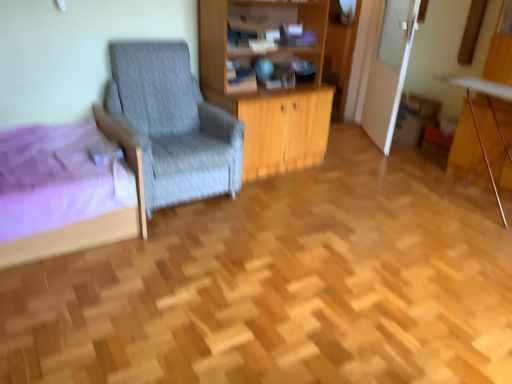
Question: Can you confirm if purple fabric bed at lower left is thinner than wooden cabinet at center?

Choices:
 (A) no
 (B) yes

Answer: (A)

Question: Is wooden cabinet at center completely or partially inside purple fabric bed at lower left?

Choices:
 (A) no
 (B) yes

Answer: (A)

Question: Is purple fabric bed at lower left bigger than wooden cabinet at center?

Choices:
 (A) no
 (B) yes

Answer: (A)

Question: Does purple fabric bed at lower left lie behind wooden cabinet at center?

Choices:
 (A) yes
 (B) no

Answer: (B)

Question: Is wooden cabinet at center at the back of purple fabric bed at lower left?

Choices:
 (A) yes
 (B) no

Answer: (B)

Question: Does purple fabric bed at lower left have a smaller size compared to wooden cabinet at center?

Choices:
 (A) yes
 (B) no

Answer: (A)

Question: Can you confirm if wooden cabinet at center is positioned to the right of gray fabric chair at left?

Choices:
 (A) no
 (B) yes

Answer: (B)

Question: Is gray fabric chair at left located within wooden cabinet at center?

Choices:
 (A) yes
 (B) no

Answer: (B)

Question: Could you tell me if wooden cabinet at center is facing gray fabric chair at left?

Choices:
 (A) yes
 (B) no

Answer: (B)

Question: Can you confirm if wooden cabinet at center is shorter than gray fabric chair at left?

Choices:
 (A) no
 (B) yes

Answer: (A)

Question: Considering the relative sizes of wooden cabinet at center and gray fabric chair at left in the image provided, is wooden cabinet at center thinner than gray fabric chair at left?

Choices:
 (A) yes
 (B) no

Answer: (A)

Question: Considering the relative sizes of wooden cabinet at center and gray fabric chair at left in the image provided, is wooden cabinet at center wider than gray fabric chair at left?

Choices:
 (A) no
 (B) yes

Answer: (A)

Question: Does wooden cabinet at center have a greater width compared to wooden desk at right?

Choices:
 (A) yes
 (B) no

Answer: (A)